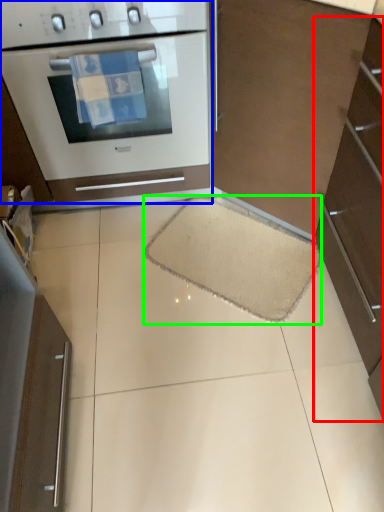
Question: Based on their relative distances, which object is nearer to cabinetry (highlighted by a red box)? Choose from home appliance (highlighted by a blue box) and doormat (highlighted by a green box).

Choices:
 (A) home appliance
 (B) doormat

Answer: (B)